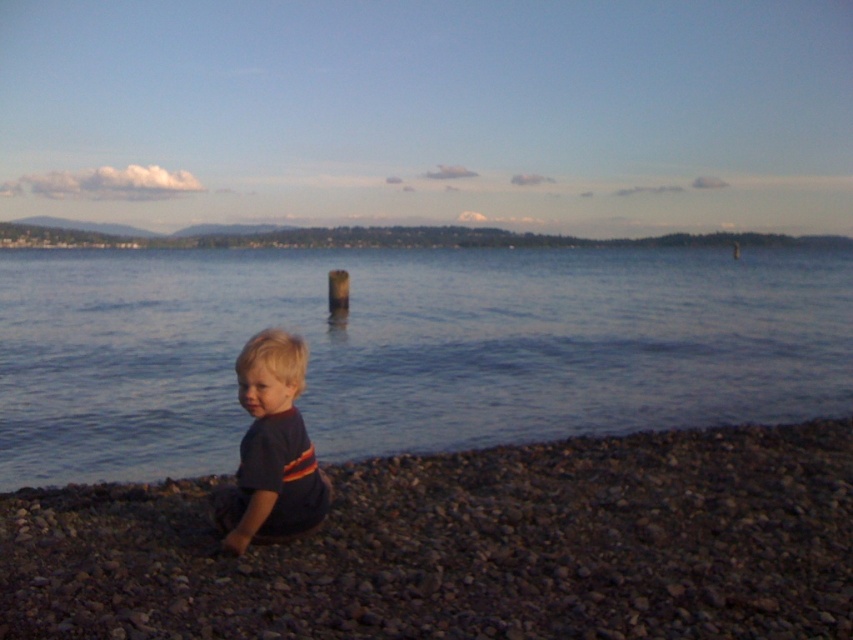
Question: Which object is closer to the camera taking this photo?

Choices:
 (A) smooth pebble at lower center
 (B) blue water at lower left
 (C) dark blue t-shirt at lower left

Answer: (A)

Question: Estimate the real-world distances between objects in this image. Which object is farther from the blue water at lower left?

Choices:
 (A) smooth pebble at lower center
 (B) dark blue t-shirt at lower left

Answer: (A)

Question: Is blue water at lower left closer to the viewer compared to dark blue t-shirt at lower left?

Choices:
 (A) yes
 (B) no

Answer: (B)

Question: Can you confirm if smooth pebble at lower center is thinner than dark blue t-shirt at lower left?

Choices:
 (A) yes
 (B) no

Answer: (B)

Question: Is blue water at lower left to the right of smooth pebble at lower center from the viewer's perspective?

Choices:
 (A) no
 (B) yes

Answer: (B)

Question: Which of the following is the closest to the observer?

Choices:
 (A) (517, 317)
 (B) (289, 508)
 (C) (839, 472)

Answer: (B)